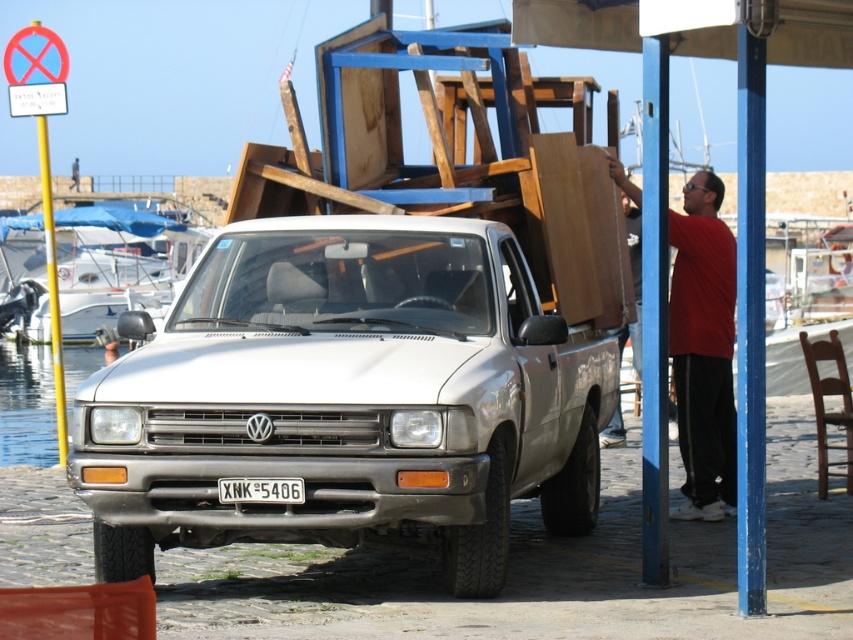
Is white matte truck at center shorter than clear water at lower left?

No, white matte truck at center is not shorter than clear water at lower left.

Based on the photo, between white matte truck at center and clear water at lower left, which one has more height?

Standing taller between the two is white matte truck at center.

Who is more forward, (514, 237) or (33, 360)?

Point (514, 237) is in front.

You are a GUI agent. You are given a task and a screenshot of the screen. Output one action in this format:
    pyautogui.click(x=<x>, y=<y>)
    Task: Click on the white matte truck at center
    The image size is (853, 640).
    Given the screenshot: What is the action you would take?
    pyautogui.click(x=346, y=397)

Does smooth brown wood at right have a lesser height compared to white plastic license plate at center?

No.

The width and height of the screenshot is (853, 640). What do you see at coordinates (630, 257) in the screenshot?
I see `smooth brown wood at right` at bounding box center [630, 257].

Find the location of a particular element. This screenshot has width=853, height=640. smooth brown wood at right is located at coordinates (630, 257).

Can you confirm if red cotton shirt at right is shorter than clear water at lower left?

No, red cotton shirt at right is not shorter than clear water at lower left.

Between red cotton shirt at right and clear water at lower left, which one appears on the left side from the viewer's perspective?

clear water at lower left

Locate an element on the screen. The height and width of the screenshot is (640, 853). red cotton shirt at right is located at coordinates (703, 349).